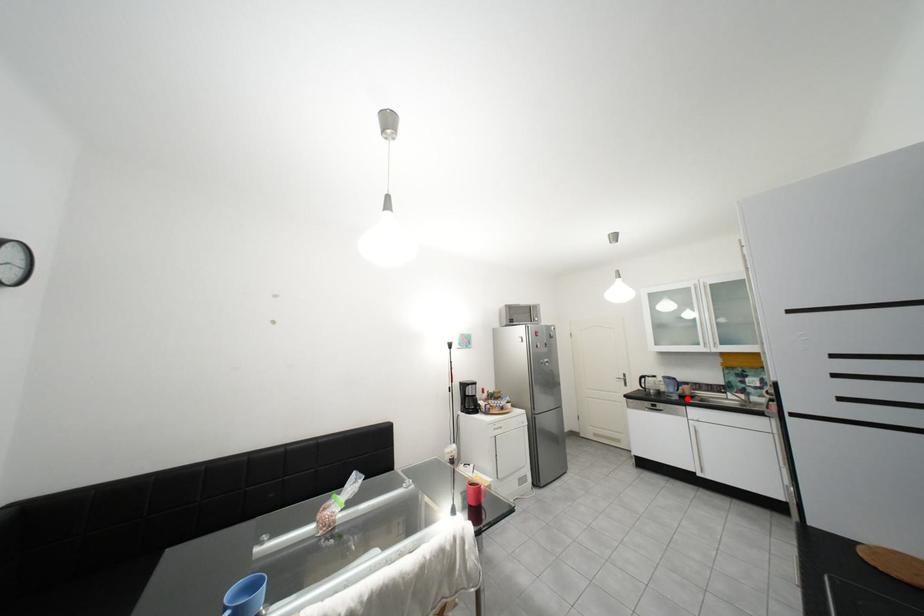
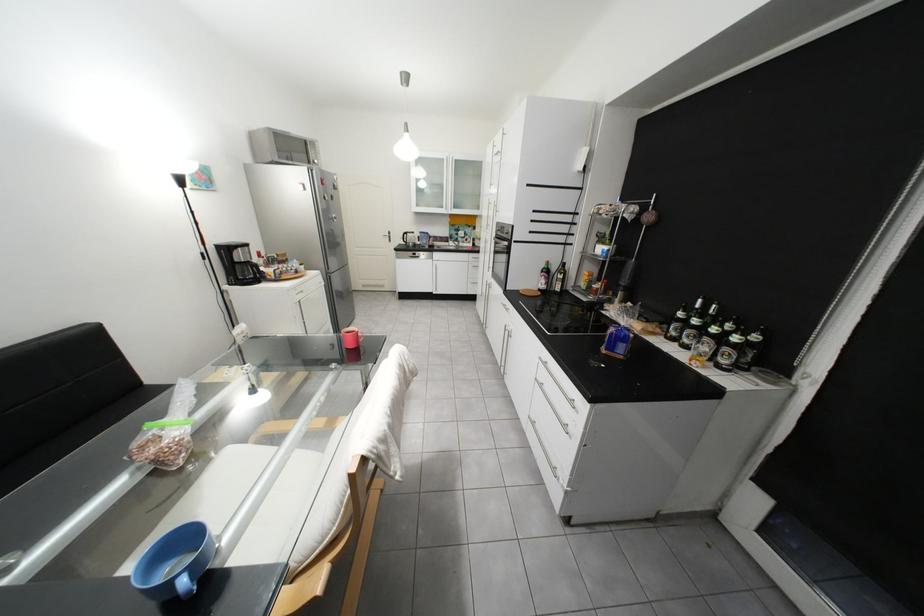
Where in the second image is the point corresponding to the highlighted location from the first image?

(439, 248)